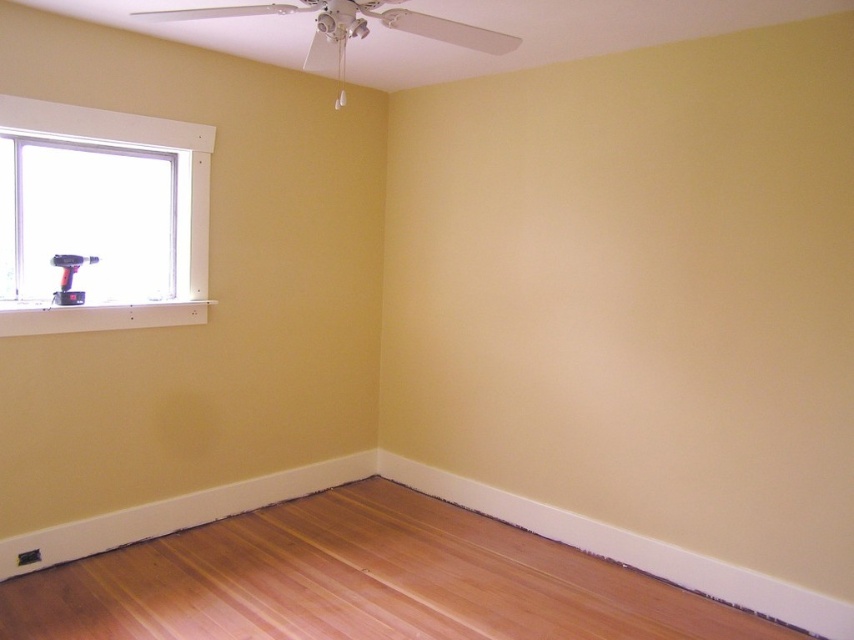
Question: Which object appears closest to the camera in this image?

Choices:
 (A) natural wood flooring at lower center
 (B) matte black drill at window

Answer: (A)

Question: Estimate the real-world distances between objects in this image. Which object is farther from the white painted wood baseboard at lower right?

Choices:
 (A) matte black drill at window
 (B) natural wood flooring at lower center

Answer: (A)

Question: Estimate the real-world distances between objects in this image. Which object is farther from the matte black drill at window?

Choices:
 (A) white painted wood baseboard at lower right
 (B) white plastic window at left

Answer: (A)

Question: Is white plastic window at left smaller than matte black drill at window?

Choices:
 (A) no
 (B) yes

Answer: (A)

Question: Can you confirm if white plastic window at left is positioned to the left of matte black drill at window?

Choices:
 (A) no
 (B) yes

Answer: (A)

Question: Is white painted wood baseboard at lower right above matte black drill at window?

Choices:
 (A) yes
 (B) no

Answer: (B)